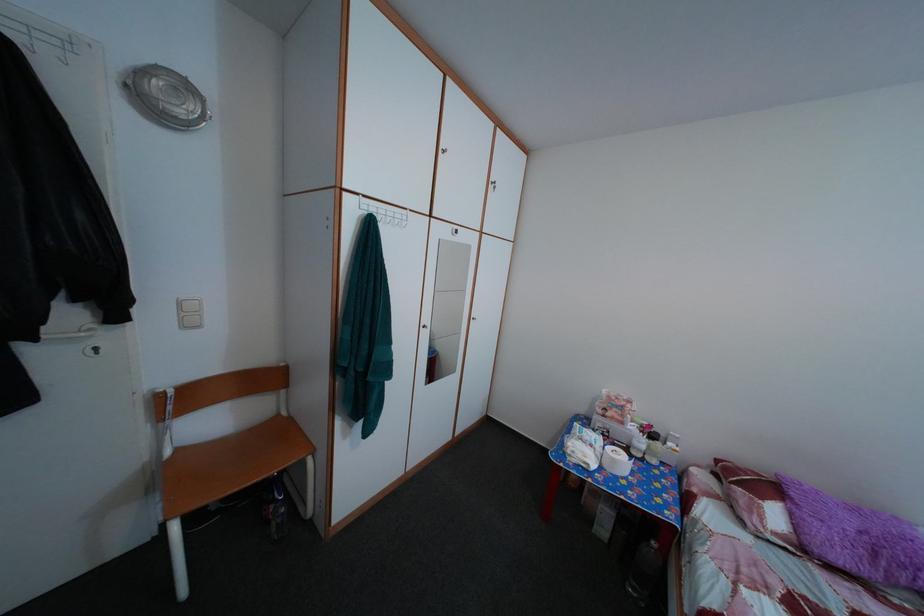
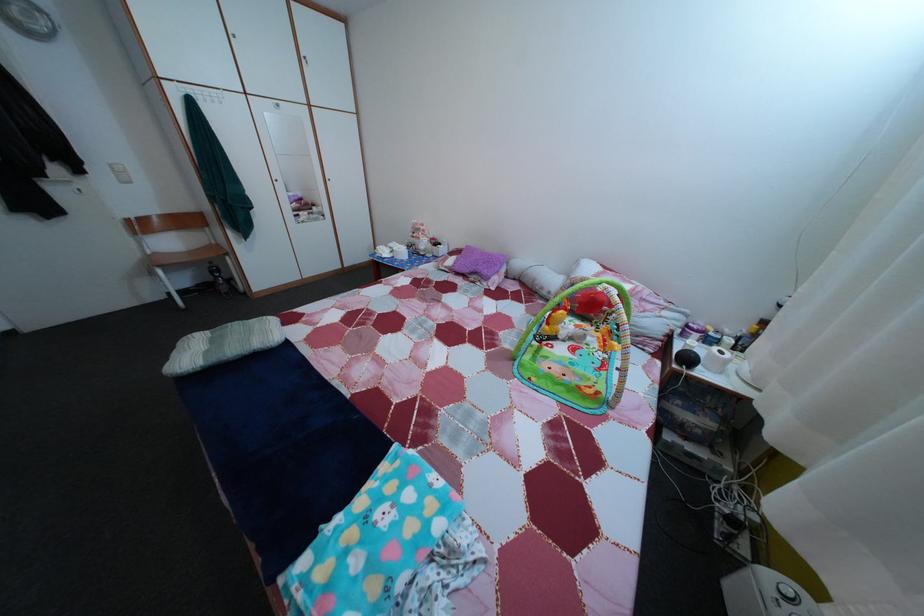
Find the pixel in the second image that matches (x=864, y=517) in the first image.

(492, 261)